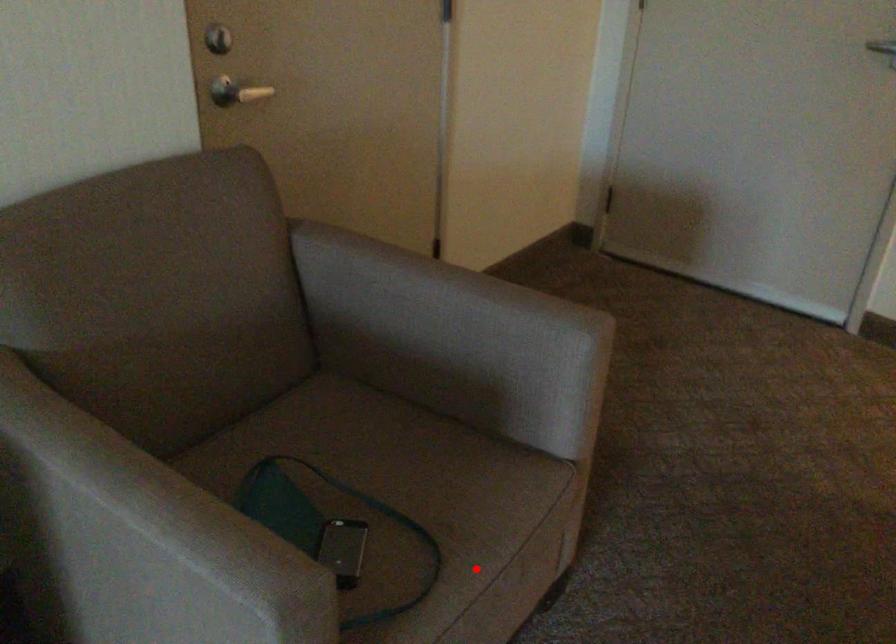
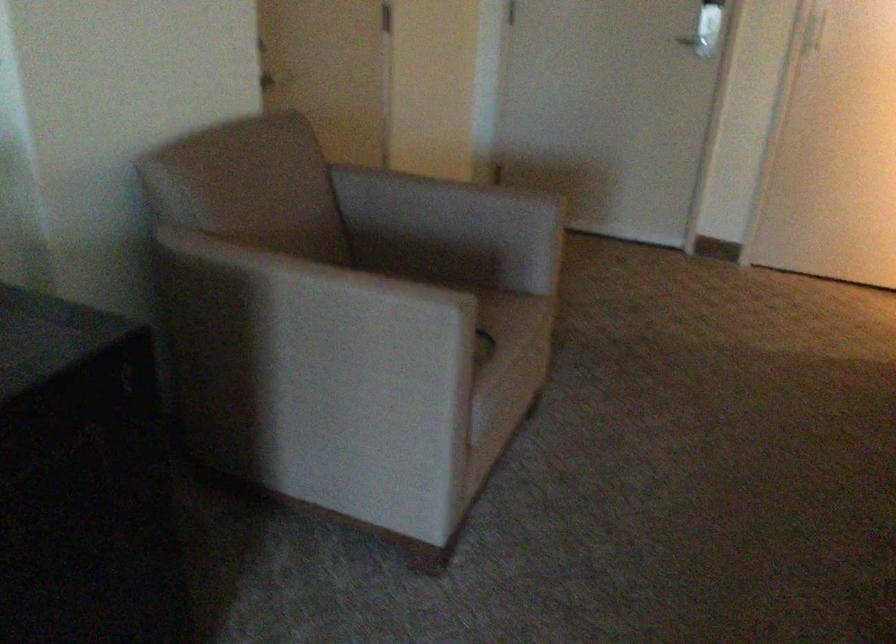
Find the pixel in the second image that matches the highlighted location in the first image.

(513, 345)